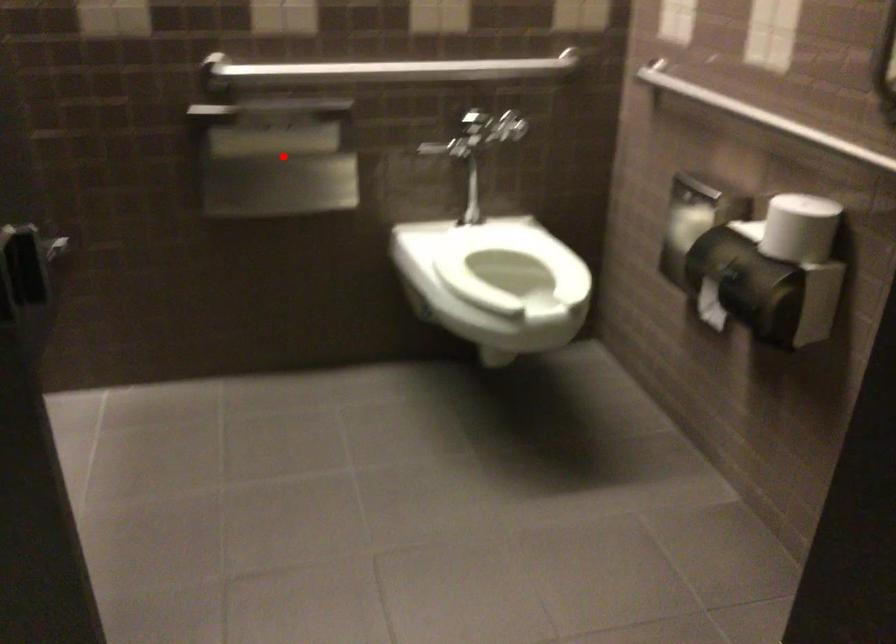
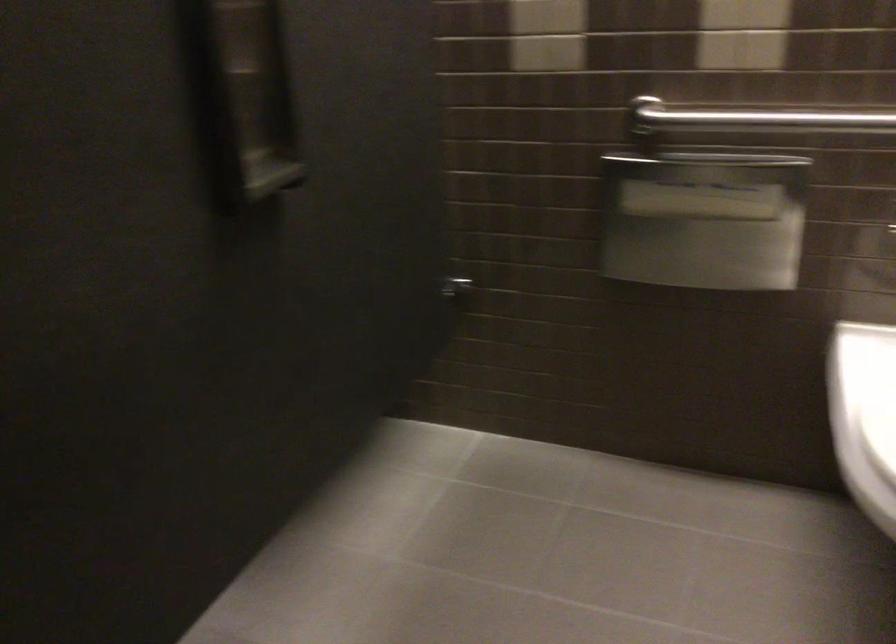
Question: I am providing you with two images of the same scene from different viewpoints. In image1, a red point is highlighted. Considering the same 3D point in image2, which of the following is correct?

Choices:
 (A) It is closer
 (B) It is farther

Answer: (A)